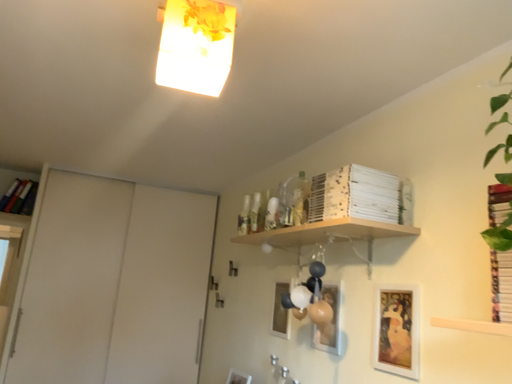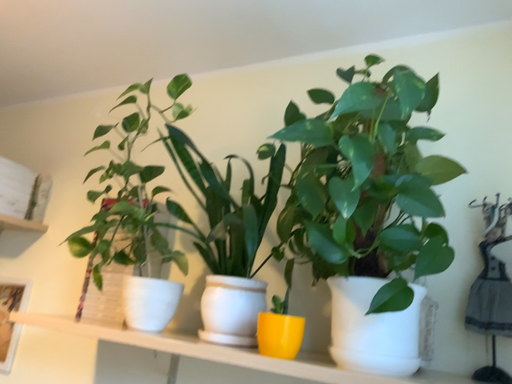
Question: Which way did the camera rotate in the video?

Choices:
 (A) rotated right
 (B) rotated left

Answer: (A)